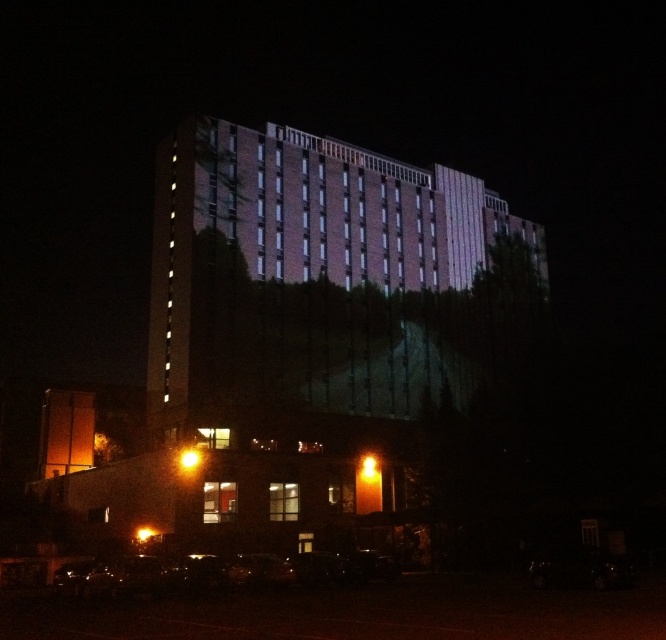
Does brick textured building at center have a smaller size compared to shiny black car at lower center?

No.

Can you confirm if brick textured building at center is positioned above shiny black car at lower center?

Correct, brick textured building at center is located above shiny black car at lower center.

Where is `brick textured building at center`? The image size is (666, 640). brick textured building at center is located at coordinates (306, 275).

You are a GUI agent. You are given a task and a screenshot of the screen. Output one action in this format:
    pyautogui.click(x=<x>, y=<y>)
    Task: Click on the brick textured building at center
    
    Given the screenshot: What is the action you would take?
    pyautogui.click(x=306, y=275)